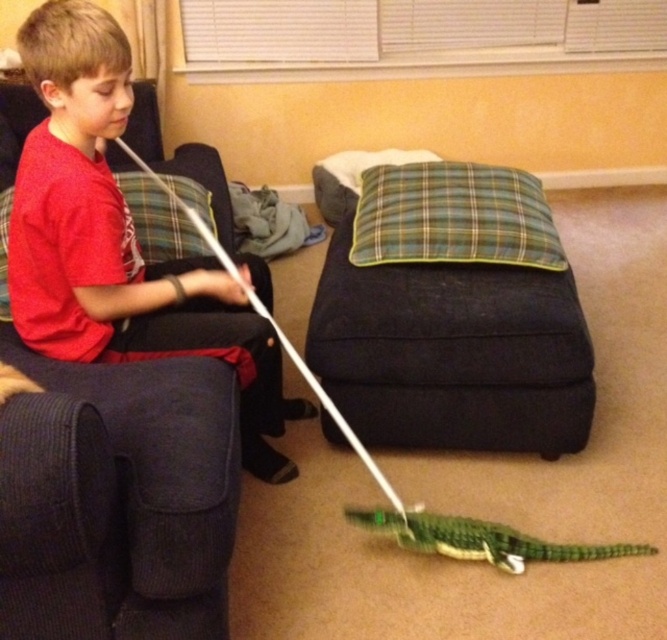
Question: Does green plaid pillow at center have a larger size compared to red matte shirt at left?

Choices:
 (A) no
 (B) yes

Answer: (A)

Question: Which point appears closest to the camera in this image?

Choices:
 (A) (119, 264)
 (B) (522, 349)

Answer: (A)

Question: Does green plaid pillow at center have a lesser width compared to red matte shirt at left?

Choices:
 (A) yes
 (B) no

Answer: (B)

Question: Which point is farther to the camera?

Choices:
 (A) red matte shirt at left
 (B) green plaid pillow at center

Answer: (B)

Question: Which of the following is the closest to the observer?

Choices:
 (A) green plaid pillow at center
 (B) red matte shirt at left

Answer: (B)

Question: Does green plaid pillow at center appear on the right side of red matte shirt at left?

Choices:
 (A) yes
 (B) no

Answer: (A)